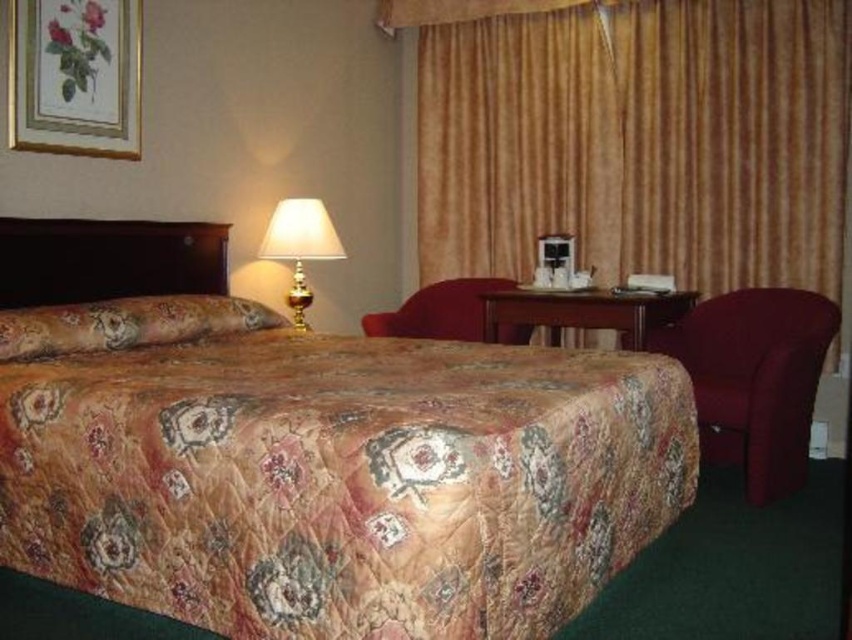
You are a guest in this hotel room and want to place a 20 inch wide decorative pillow between the velvet gold curtain at upper right and the velvet burgundy armchair at right. Is there enough space to fit the pillow between them?

The velvet gold curtain at upper right is 39.32 inches from the velvet burgundy armchair at right. Since the pillow is 20 inches wide, there is enough space to place it between them as 39.32 inches is greater than 20 inches.

You are a hotel guest who wants to adjust the lighting in your room. You have the option to use either the velvet gold curtain at upper right or the gold metallic table lamp at upper center. Which object can you use to cover more horizontal space when adjusting?

The velvet gold curtain at upper right has a larger width than the gold metallic table lamp at upper center, so it can cover more horizontal space when adjusting.